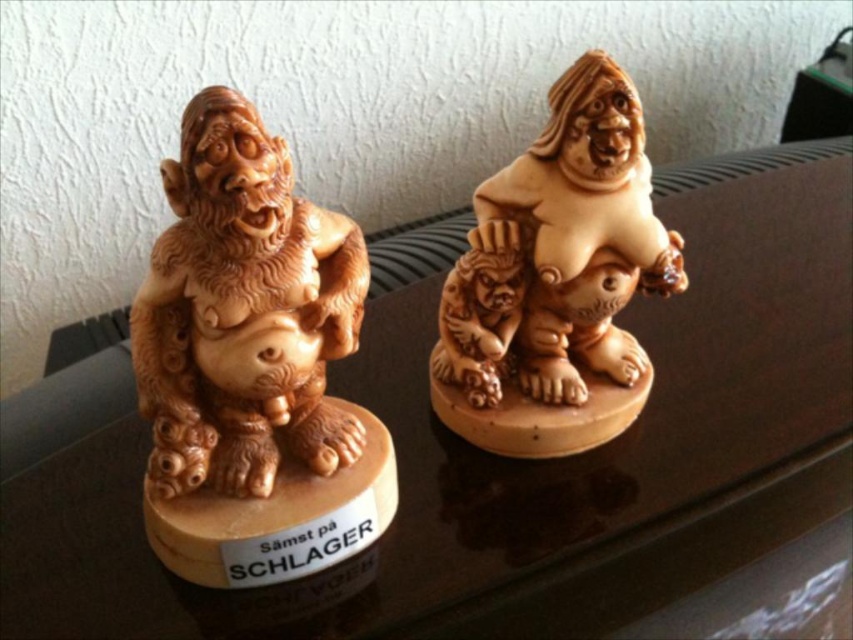
Between wooden statue at left and matte wood statue at center, which one has less height?

With less height is matte wood statue at center.

Does wooden statue at left have a greater height compared to matte wood statue at center?

Yes, wooden statue at left is taller than matte wood statue at center.

Locate an element on the screen. The image size is (853, 640). wooden statue at left is located at coordinates (252, 364).

Find the location of `wooden statue at left`. wooden statue at left is located at coordinates (252, 364).